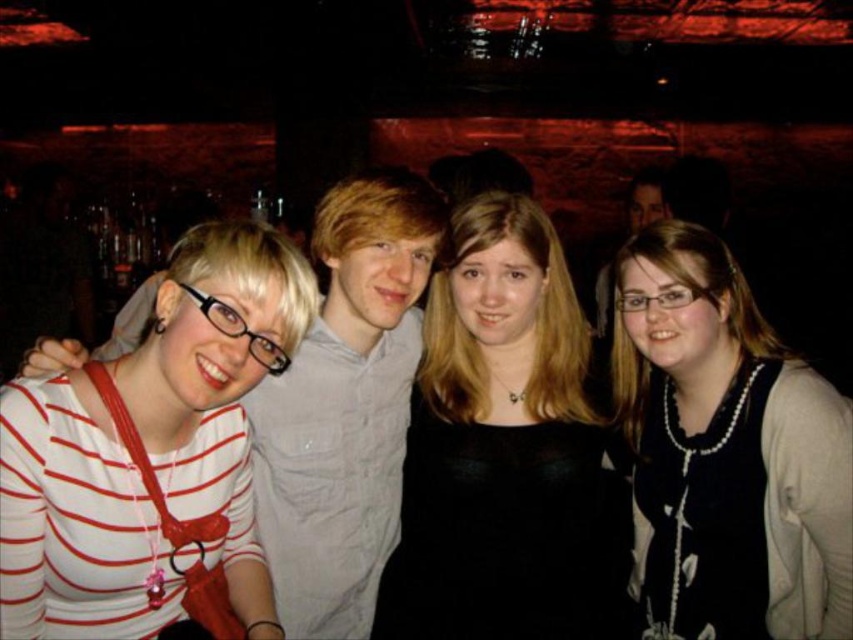
You are a photographer adjusting the camera settings for a group photo. You need to ensure that the pearl necklace at center and the white striped shirt at left are both clearly visible in the final image. Given their sizes, which object should you focus on first to ensure proper exposure?

The pearl necklace at center has a lesser width compared to the white striped shirt at left, so you should focus on the pearl necklace at center first to ensure its smaller details are properly exposed.